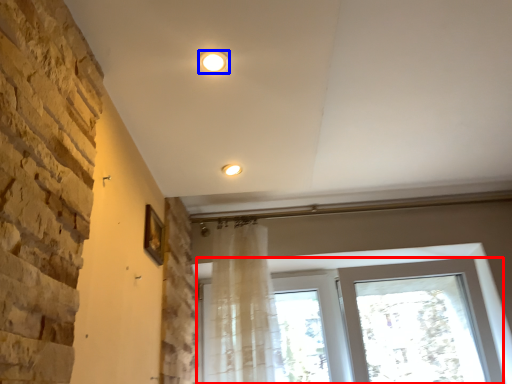
Question: Which point is further to the camera, window (highlighted by a red box) or lighting (highlighted by a blue box)?

Choices:
 (A) window
 (B) lighting

Answer: (A)